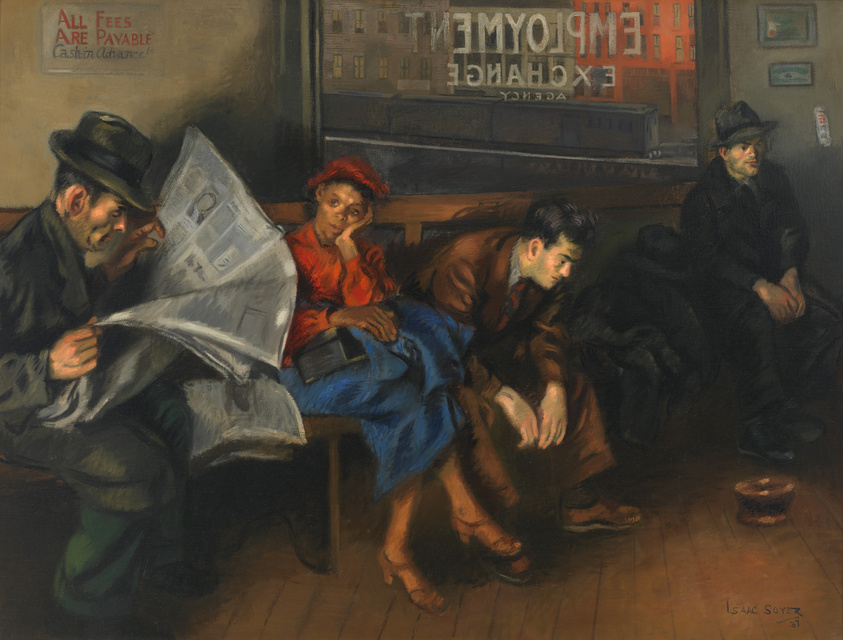
Where is `window`? The width and height of the screenshot is (843, 640). window is located at coordinates (662, 114).